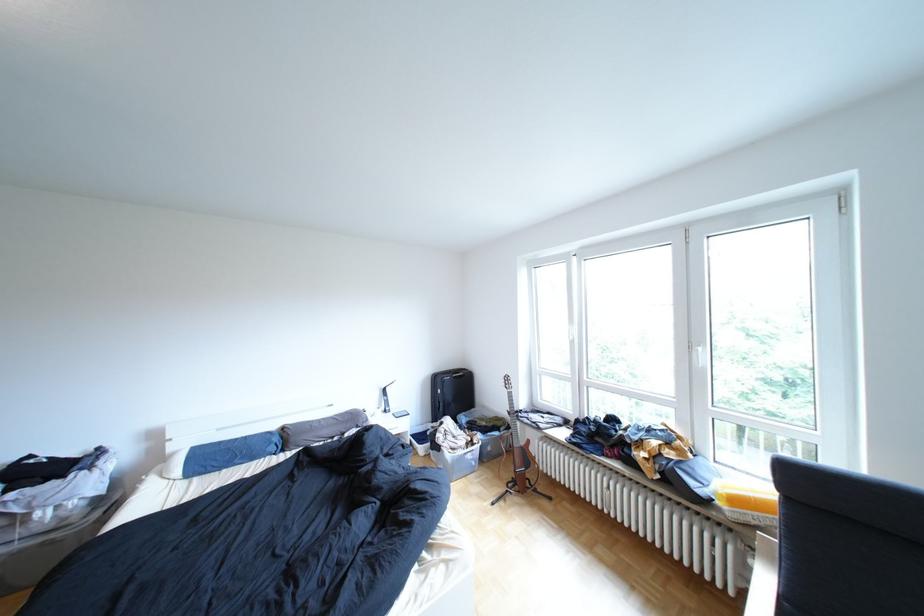
Find the location of a particular element. The width and height of the screenshot is (924, 616). white desk lamp is located at coordinates (385, 398).